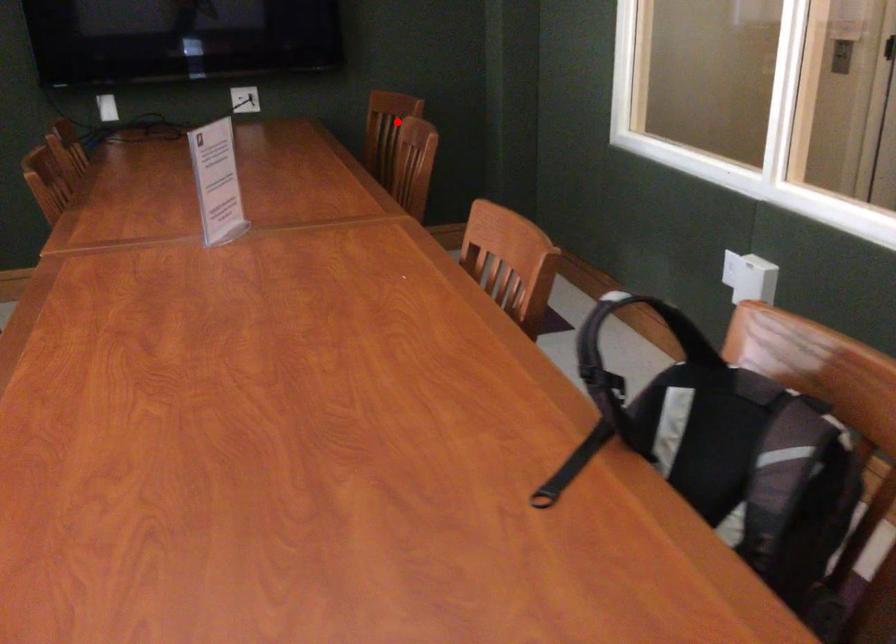
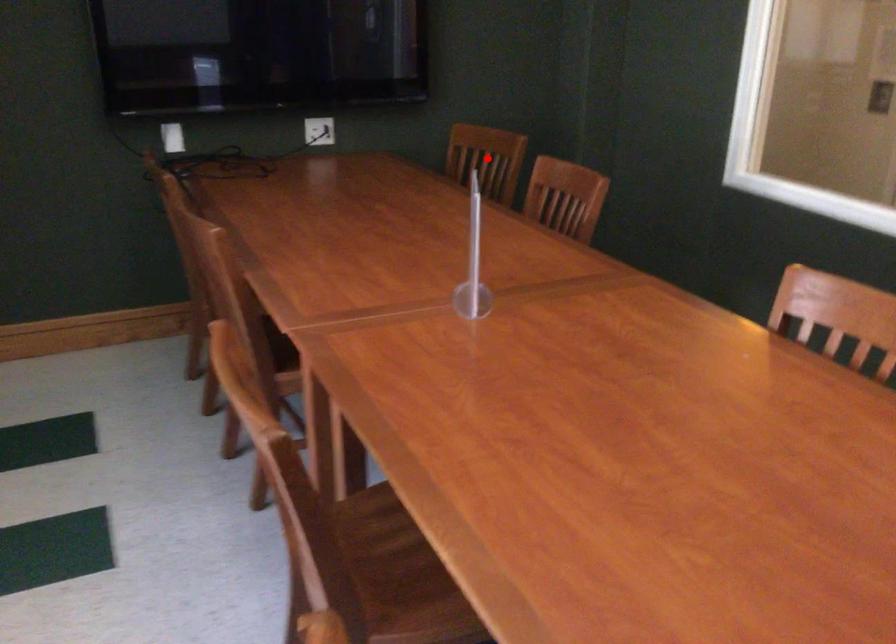
I am providing you with two images of the same scene from different viewpoints. A red point is marked on the first image and another point is marked on the second image. Is the red point in image1 aligned with the point shown in image2?

Yes